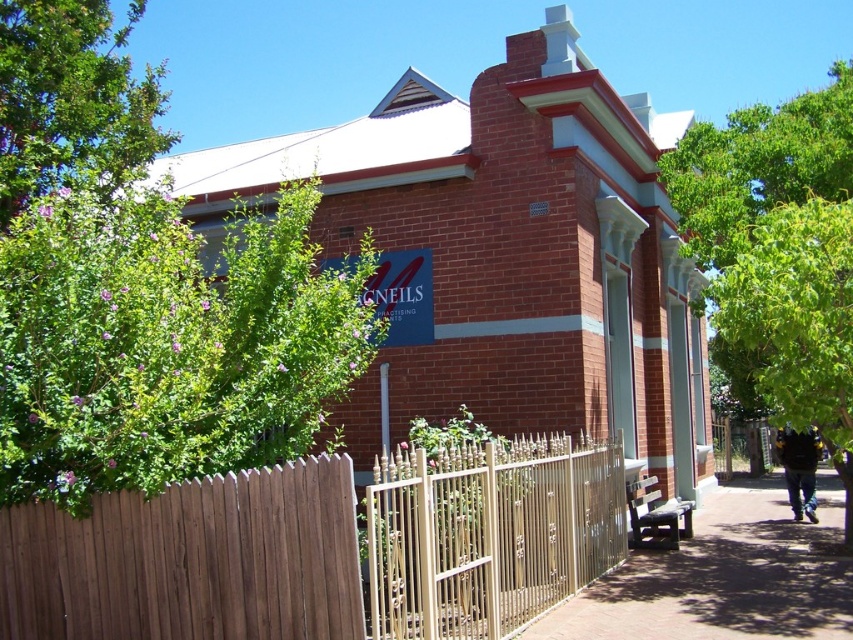
What do you see at coordinates (167, 342) in the screenshot? I see `green leafy bush at left` at bounding box center [167, 342].

Is green leafy bush at left below green leafy tree at upper left?

Yes.

Find the location of a particular element. The image size is (853, 640). green leafy bush at left is located at coordinates (167, 342).

At what (x,y) coordinates should I click in order to perform the action: click on green leafy bush at left. Please return your answer as a coordinate pair (x, y). This screenshot has height=640, width=853. Looking at the image, I should click on (167, 342).

Does green leafy tree at right have a greater height compared to gold wrought iron fence at center?

Yes, green leafy tree at right is taller than gold wrought iron fence at center.

Between point (717, 257) and point (567, 538), which one is positioned in front?

Positioned in front is point (567, 538).

Between point (761, 352) and point (523, 564), which one is positioned behind?

Point (761, 352)

Locate an element on the screen. The image size is (853, 640). green leafy tree at right is located at coordinates (778, 253).

Does gold wrought iron fence at center have a lesser height compared to brown brick pavement at lower right?

No.

The height and width of the screenshot is (640, 853). I want to click on gold wrought iron fence at center, so click(489, 532).